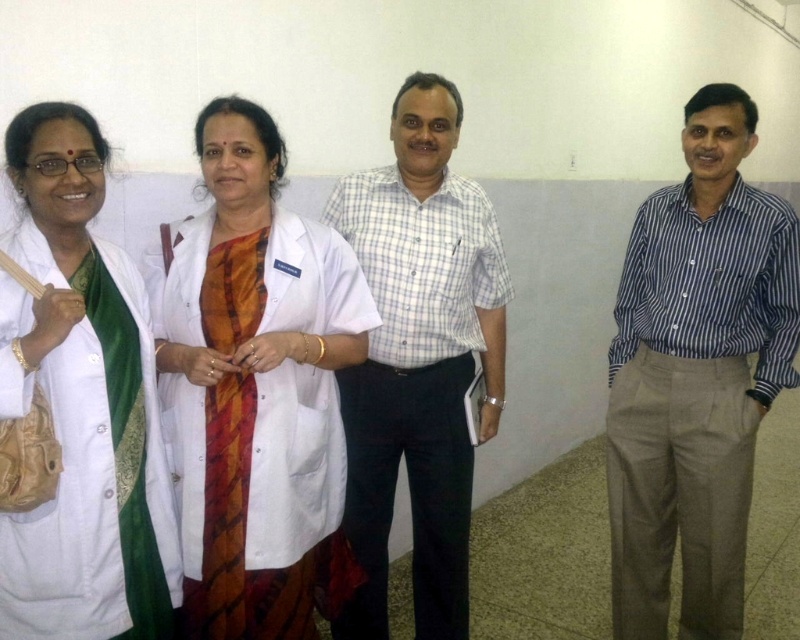
You are standing in front of the group of four people. There are two points marked in the image. One is at coordinate point (678, 518) and the other is at point (110, 580). Which point is closer to you?

Point (678, 518) is further to the viewer than point (110, 580), so the point closer to you is point (110, 580).

You are organizing a photo shoot and need to arrange two items in the scene. The white matte lab coat at left and the orange striped fabric at center are both required to be placed on a table. Considering their widths, which one should be placed first to ensure they both fit on the table?

The white matte lab coat at left might be wider than orange striped fabric at center, so you should place the narrower orange striped fabric at center first to ensure both items fit on the table.

You are organizing a photo shoot and need to arrange the blue striped shirt at center and the white matte lab coat at left in a row. Which one should you place first if you want the wider item to be on the right side?

The blue striped shirt at center has a larger width than the white matte lab coat at left, so you should place the white matte lab coat at left first to have the wider item on the right side.